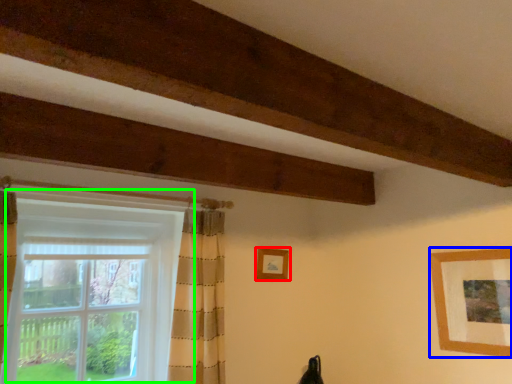
Question: Which object is positioned farthest from picture frame (highlighted by a red box)? Select from picture frame (highlighted by a blue box) and window (highlighted by a green box).

Choices:
 (A) picture frame
 (B) window

Answer: (A)